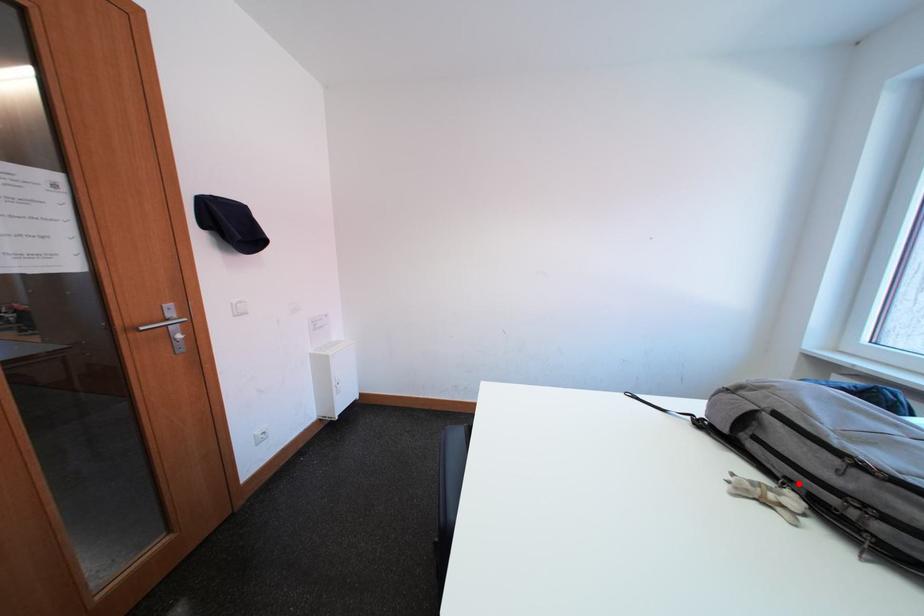
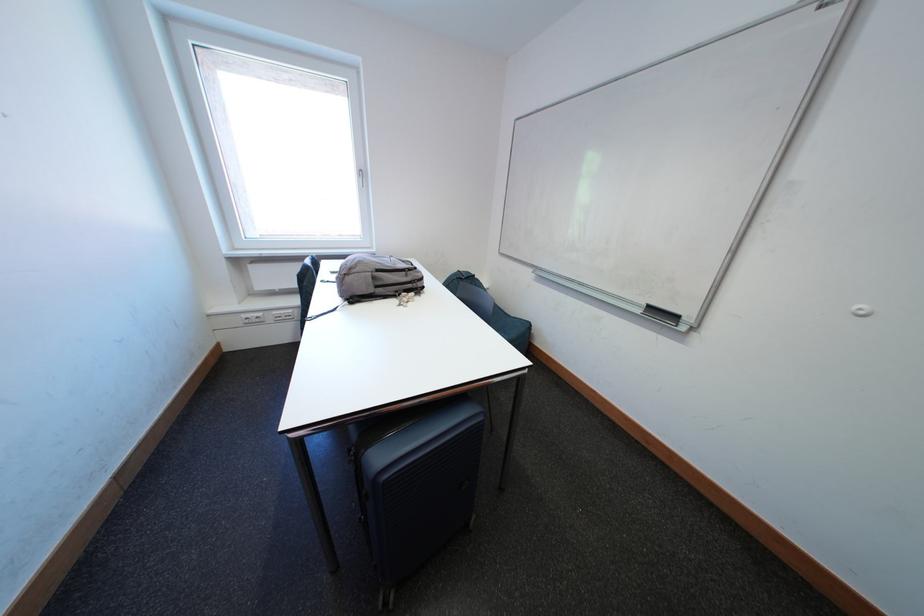
Where in the second image is the point corresponding to the highlighted location from the first image?

(406, 294)